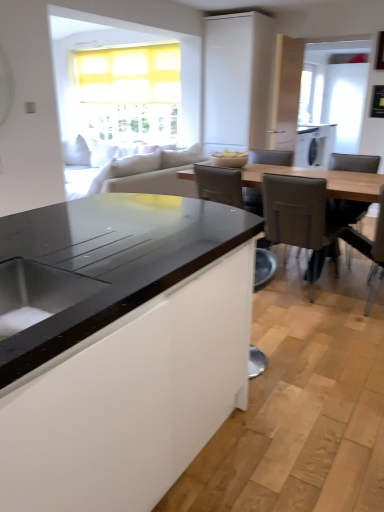
Question: From a real-world perspective, does white matte cabinet at upper center stand above brown leather chair at right, which is the third chair from left to right?

Choices:
 (A) yes
 (B) no

Answer: (A)

Question: Does white matte cabinet at upper center have a lesser width compared to brown leather chair at right, positioned as the 2th chair in right-to-left order?

Choices:
 (A) yes
 (B) no

Answer: (A)

Question: Is brown leather chair at right, which is the third chair from left to right, completely or partially inside white matte cabinet at upper center?

Choices:
 (A) yes
 (B) no

Answer: (B)

Question: Is white matte cabinet at upper center further to camera compared to brown leather chair at right, which is the third chair from left to right?

Choices:
 (A) no
 (B) yes

Answer: (B)

Question: From the image's perspective, does white matte cabinet at upper center appear higher than brown leather chair at right, which is the third chair from left to right?

Choices:
 (A) no
 (B) yes

Answer: (B)

Question: Considering the relative positions of leatherette chair at right, the fourth chair from the left, and leatherette chair at right, acting as the second chair starting from the left, in the image provided, is leatherette chair at right, the fourth chair from the left, to the left or to the right of leatherette chair at right, acting as the second chair starting from the left,?

Choices:
 (A) right
 (B) left

Answer: (A)

Question: Is leatherette chair at right, the fourth chair from the left, bigger or smaller than leatherette chair at right, acting as the second chair starting from the left?

Choices:
 (A) small
 (B) big

Answer: (B)

Question: From a real-world perspective, is leatherette chair at right, the first chair from the right, above or below leatherette chair at right, which ranks as the 3th chair in right-to-left order?

Choices:
 (A) below
 (B) above

Answer: (A)

Question: Is point (374, 169) positioned closer to the camera than point (312, 202)?

Choices:
 (A) closer
 (B) farther

Answer: (B)

Question: Is leatherette chair at right, the fourth chair from the left, to the left or to the right of matte white bowl at center in the image?

Choices:
 (A) right
 (B) left

Answer: (A)

Question: Considering the positions of leatherette chair at right, the first chair from the right, and matte white bowl at center in the image, is leatherette chair at right, the first chair from the right, bigger or smaller than matte white bowl at center?

Choices:
 (A) small
 (B) big

Answer: (B)

Question: From their relative heights in the image, would you say leatherette chair at right, the first chair from the right, is taller or shorter than matte white bowl at center?

Choices:
 (A) short
 (B) tall

Answer: (B)

Question: Relative to matte white bowl at center, is leatherette chair at right, the first chair from the right, in front or behind?

Choices:
 (A) front
 (B) behind

Answer: (A)

Question: Relative to leatherette chair at right, acting as the second chair starting from the left, is metallic gray chair at lower center, which is the 4th chair in right-to-left order, in front or behind?

Choices:
 (A) front
 (B) behind

Answer: (A)

Question: Does point (266, 361) appear closer or farther from the camera than point (286, 243)?

Choices:
 (A) farther
 (B) closer

Answer: (B)